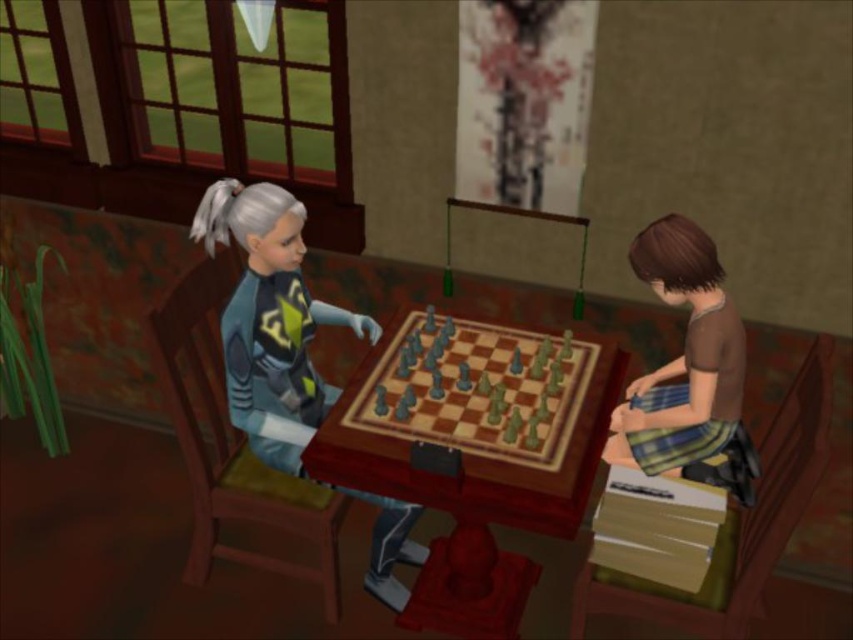
Who is positioned more to the right, matte blue jacket at center or gray plastic chessboard at center?

From the viewer's perspective, gray plastic chessboard at center appears more on the right side.

Does point (291, 440) lie behind point (428, 436)?

Yes.

Identify the location of matte blue jacket at center. This screenshot has width=853, height=640. (271, 321).

Locate an element on the screen. The height and width of the screenshot is (640, 853). matte blue jacket at center is located at coordinates (271, 321).

Is gray plastic chessboard at center wider than brown fabric shirt at lower right?

Correct, the width of gray plastic chessboard at center exceeds that of brown fabric shirt at lower right.

Is gray plastic chessboard at center below brown fabric shirt at lower right?

Yes.

What do you see at coordinates (477, 388) in the screenshot?
I see `gray plastic chessboard at center` at bounding box center [477, 388].

This screenshot has height=640, width=853. In order to click on gray plastic chessboard at center in this screenshot , I will do `click(477, 388)`.

Is wooden chessboard at center above matte blue jacket at center?

Correct, wooden chessboard at center is located above matte blue jacket at center.

Does point (440, 419) come farther from viewer compared to point (291, 230)?

Yes, it is.

Measure the distance between point (531, 332) and camera.

Point (531, 332) is 2.55 meters from camera.

Locate an element on the screen. wooden chessboard at center is located at coordinates (469, 488).